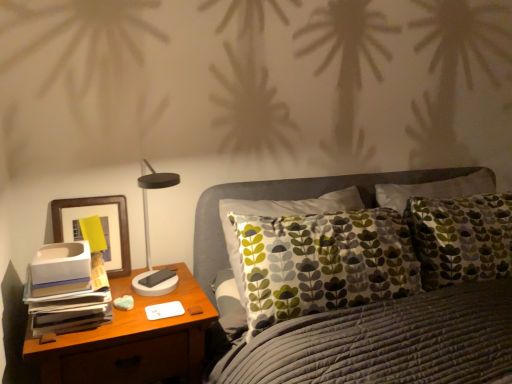
Question: Is wooden nightstand at left bigger or smaller than matte black table lamp at left?

Choices:
 (A) small
 (B) big

Answer: (B)

Question: Considering the positions of wooden nightstand at left and matte black table lamp at left in the image, is wooden nightstand at left taller or shorter than matte black table lamp at left?

Choices:
 (A) short
 (B) tall

Answer: (B)

Question: Estimate the real-world distances between objects in this image. Which object is farther from the matte black table lamp at left?

Choices:
 (A) wooden picture frame at left
 (B) wooden nightstand at left

Answer: (B)

Question: Considering the real-world distances, which object is closest to the wooden picture frame at left?

Choices:
 (A) matte black table lamp at left
 (B) wooden nightstand at left

Answer: (A)